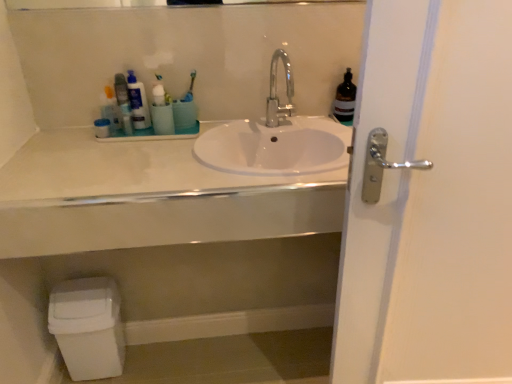
The height and width of the screenshot is (384, 512). I want to click on vacant area situated to the left side of matte plastic container at upper left, placed as the first toiletry when sorted from left to right, so click(62, 135).